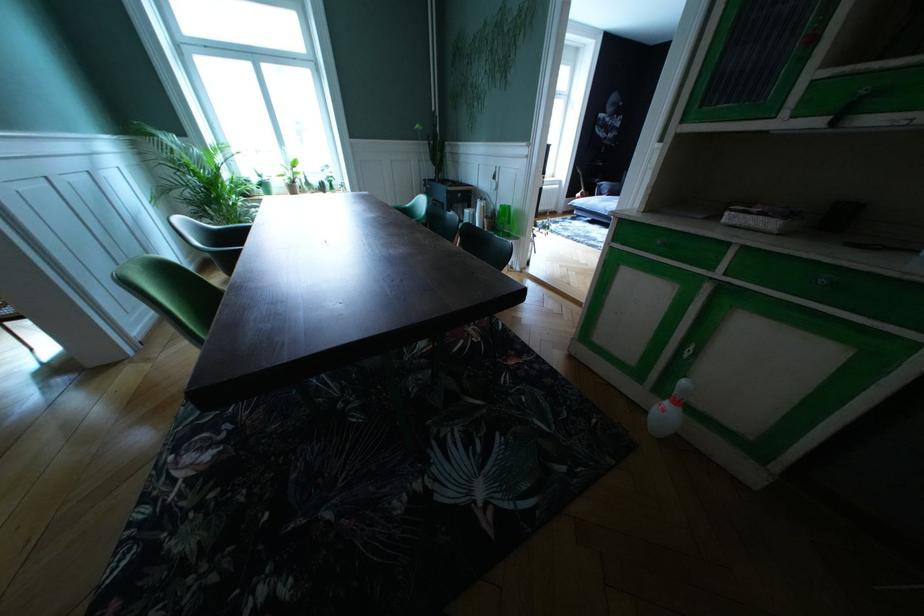
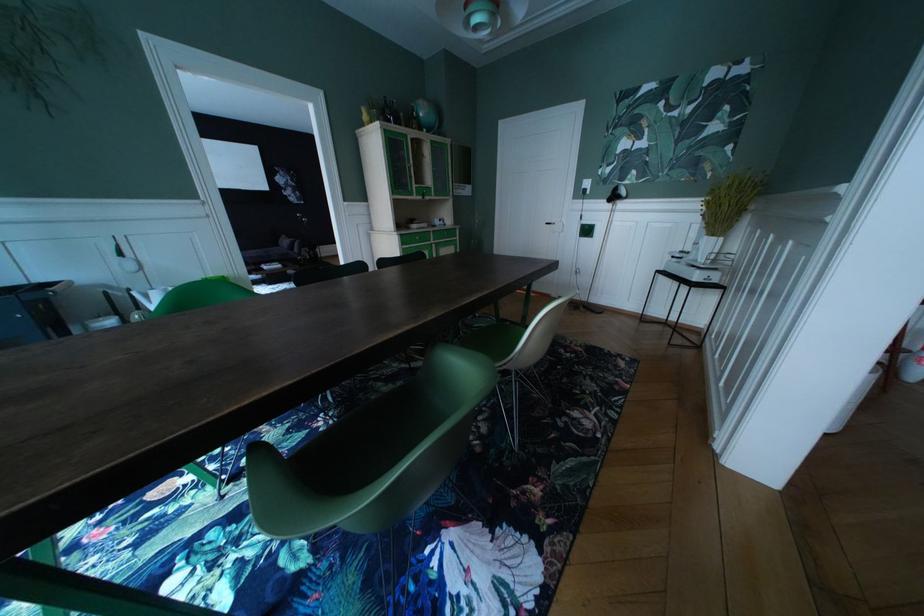
Where in the second image is the point corresponding to (x=152, y=507) from the first image?

(623, 428)